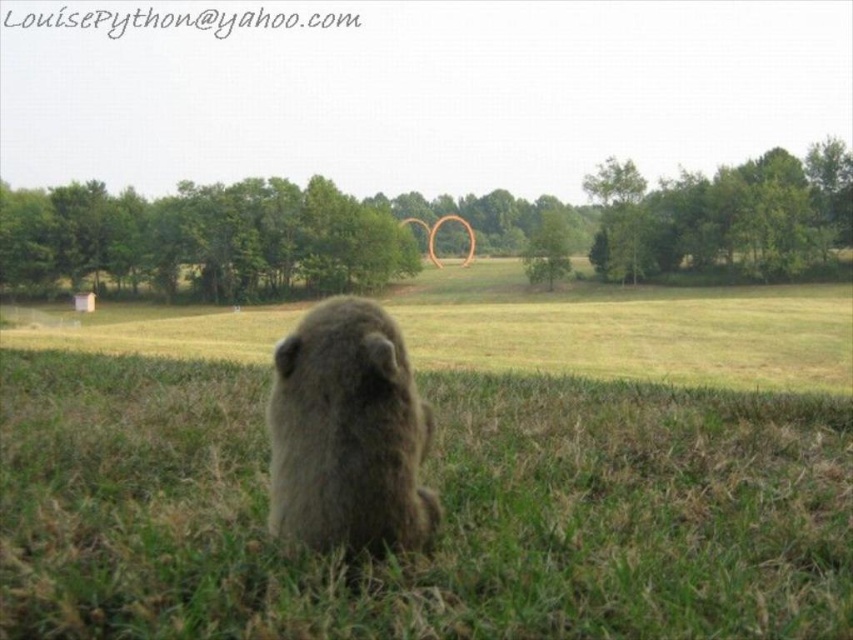
You are a photographer trying to capture a clear shot of the fuzzy brown groundhog at center. Since the green grass at center is in the way, will you need to adjust your camera angle to get the groundhog in focus?

The green grass at center is not as tall as the fuzzy brown groundhog at center, so the grass is shorter than the groundhog. Therefore, adjusting the camera angle slightly downward might help focus on the groundhog without obstruction.

Where is the green grass at center located in the image?

The green grass at center is located at point 0.797 on the x axis and 0.522 on the y axis.